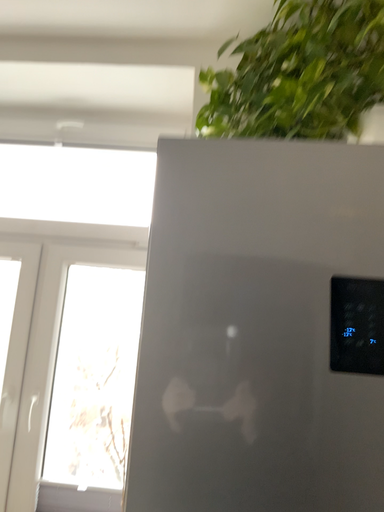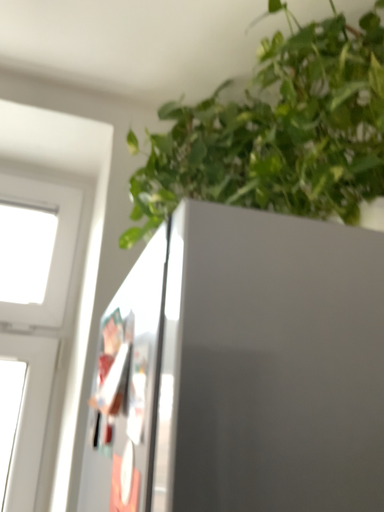
Question: Which way did the camera rotate in the video?

Choices:
 (A) rotated right
 (B) rotated left

Answer: (A)